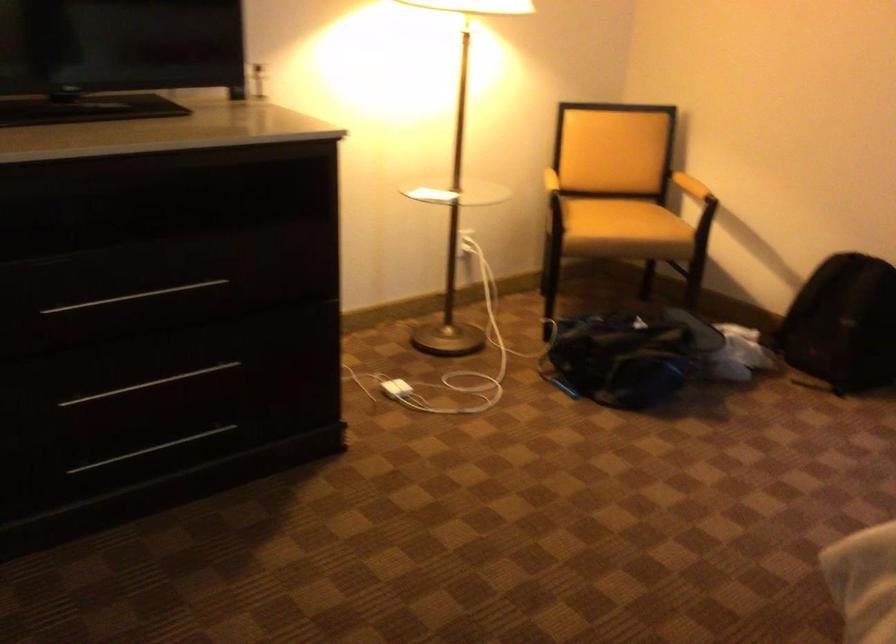
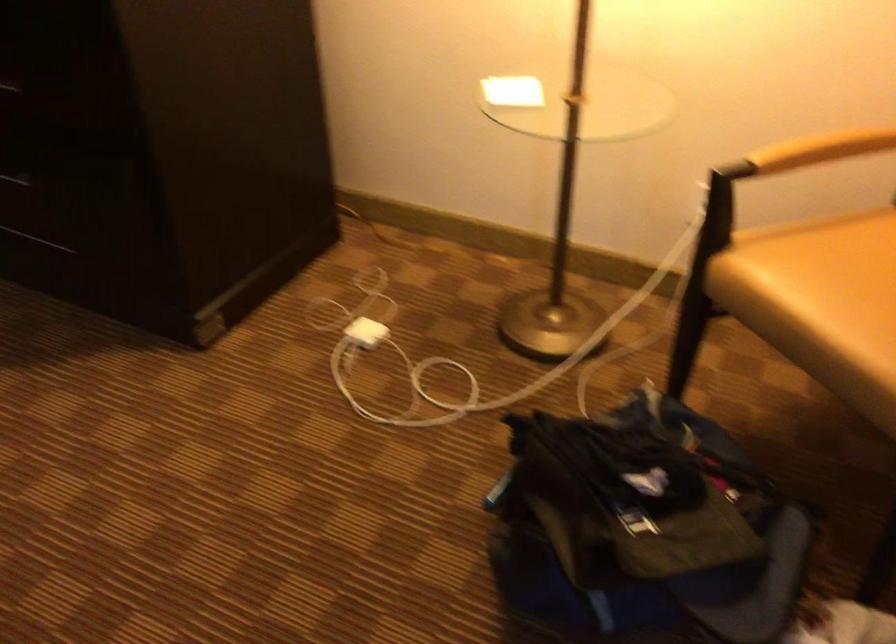
Find the pixel in the second image that matches [391,392] in the first image.

(366, 332)